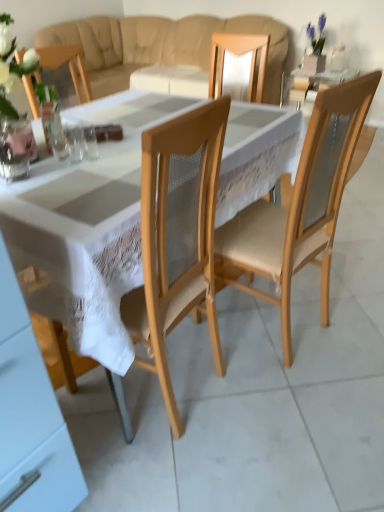
Where is `free space in front of clear glass cup at center, the third tableware positioned from the left`? Image resolution: width=384 pixels, height=512 pixels. free space in front of clear glass cup at center, the third tableware positioned from the left is located at coordinates (72, 179).